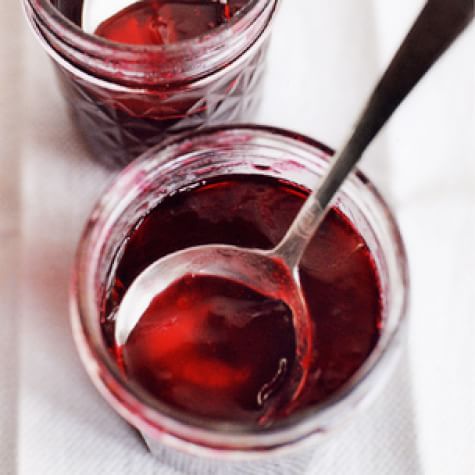
Find the location of a particular element. 1 partial spoon in top jar is located at coordinates (100, 15).